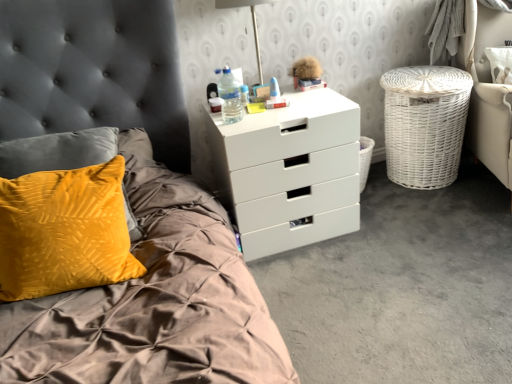
Image resolution: width=512 pixels, height=384 pixels. Identify the location of free point behind translucent plastic water bottle at upper right. (245, 103).